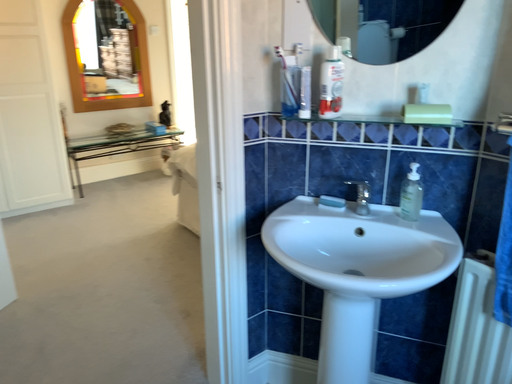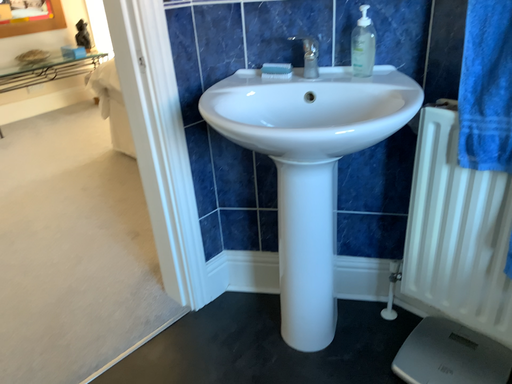
Question: How did the camera likely rotate when shooting the video?

Choices:
 (A) rotated right
 (B) rotated left

Answer: (A)